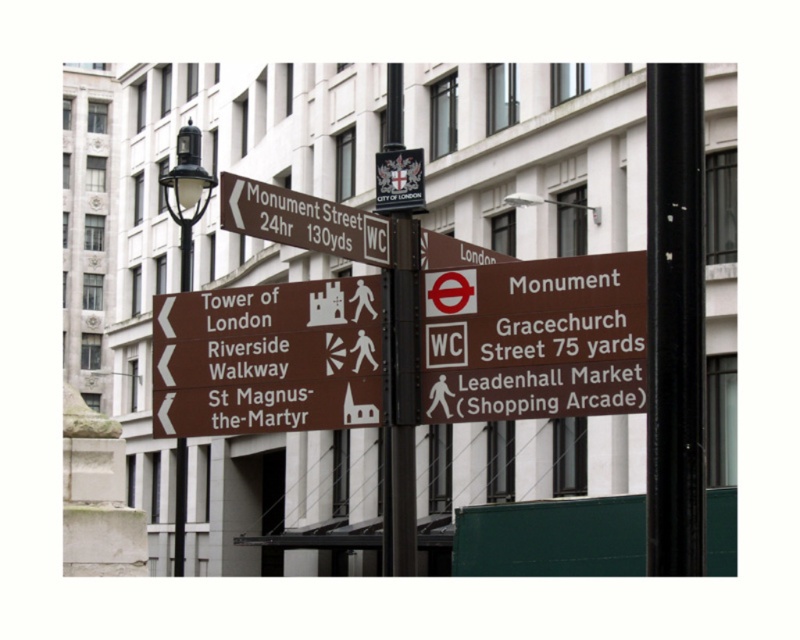
Is black metal pole at right smaller than black polished metal streetlight at left?

Yes.

Does black metal pole at right have a lesser width compared to black polished metal streetlight at left?

Correct, black metal pole at right's width is less than black polished metal streetlight at left's.

Identify the location of black metal pole at right. (674, 320).

Where is `black metal pole at right`? black metal pole at right is located at coordinates click(x=674, y=320).

Can you confirm if black metal pole at right is positioned below brown matte sign at upper left?

Actually, black metal pole at right is above brown matte sign at upper left.

Which is more to the left, black metal pole at right or brown matte sign at upper left?

brown matte sign at upper left

Does point (678, 323) come farther from viewer compared to point (368, 252)?

No.

Locate an element on the screen. The width and height of the screenshot is (800, 640). black metal pole at right is located at coordinates (674, 320).

Who is more distant from viewer, (384, 218) or (184, 209)?

The point (184, 209) is more distant.

Who is more forward, [226,211] or [208,182]?

Point [226,211] is in front.

Where is `brown matte sign at upper left`? The height and width of the screenshot is (640, 800). brown matte sign at upper left is located at coordinates (302, 220).